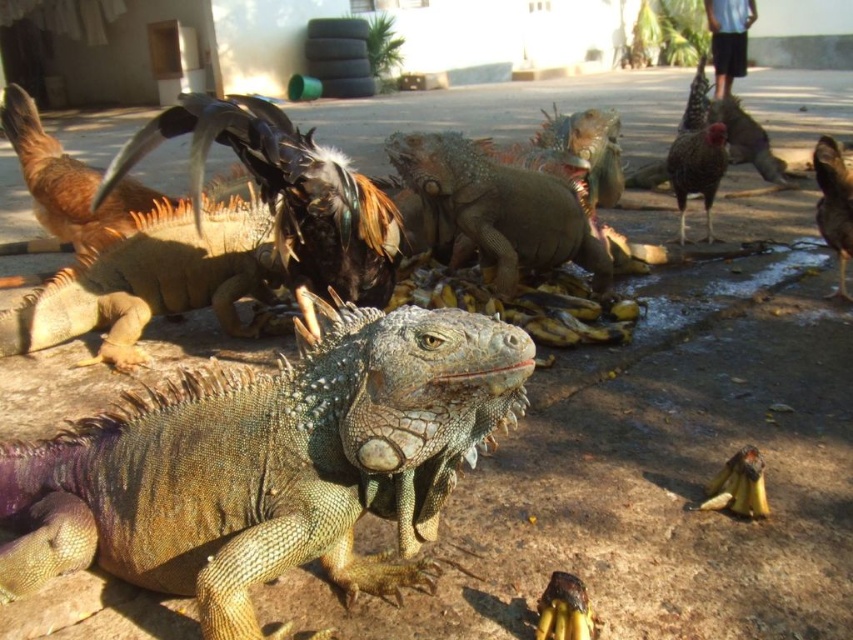
Question: Which object appears closest to the camera in this image?

Choices:
 (A) speckled feathered rooster at right
 (B) shiny brown feathers at right
 (C) shiny black feathers at center

Answer: (C)

Question: Which object is farther from the camera taking this photo?

Choices:
 (A) shiny black feathers at center
 (B) shiny brown iguana at center
 (C) shiny brown feathers at right
 (D) green scaly iguana at center

Answer: (D)

Question: Can you confirm if shiny brown iguana at center is positioned above green scaly iguana at center?

Choices:
 (A) yes
 (B) no

Answer: (B)

Question: Observing the image, what is the correct spatial positioning of speckled feathered rooster at right in reference to shiny brown feathers at right?

Choices:
 (A) below
 (B) above

Answer: (B)

Question: Can you confirm if green scaly iguana at center is wider than speckled feathered rooster at right?

Choices:
 (A) no
 (B) yes

Answer: (B)

Question: Which of the following is the farthest from the observer?

Choices:
 (A) speckled feathered rooster at right
 (B) shiny brown iguana at center
 (C) shiny black feathers at center
 (D) shiny brown feathers at right

Answer: (A)